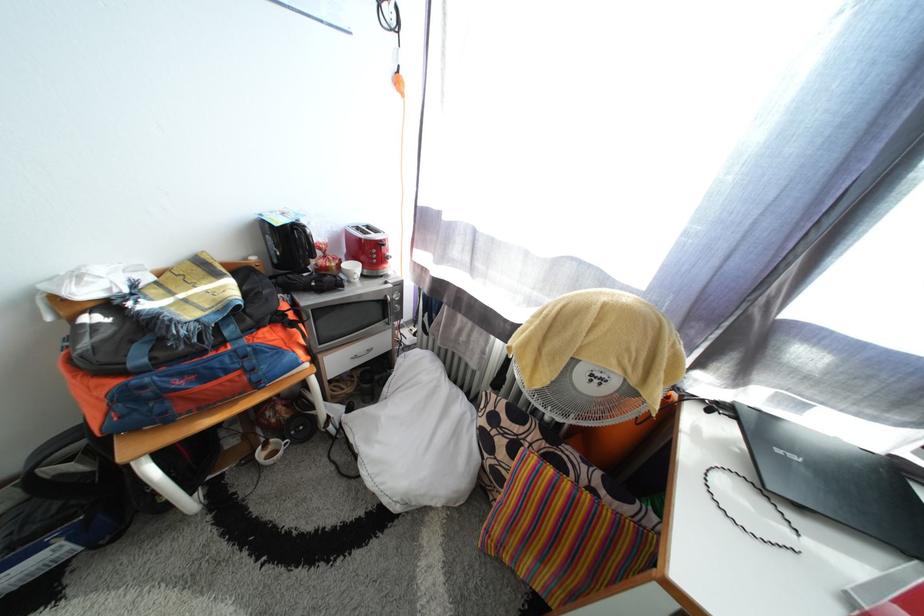
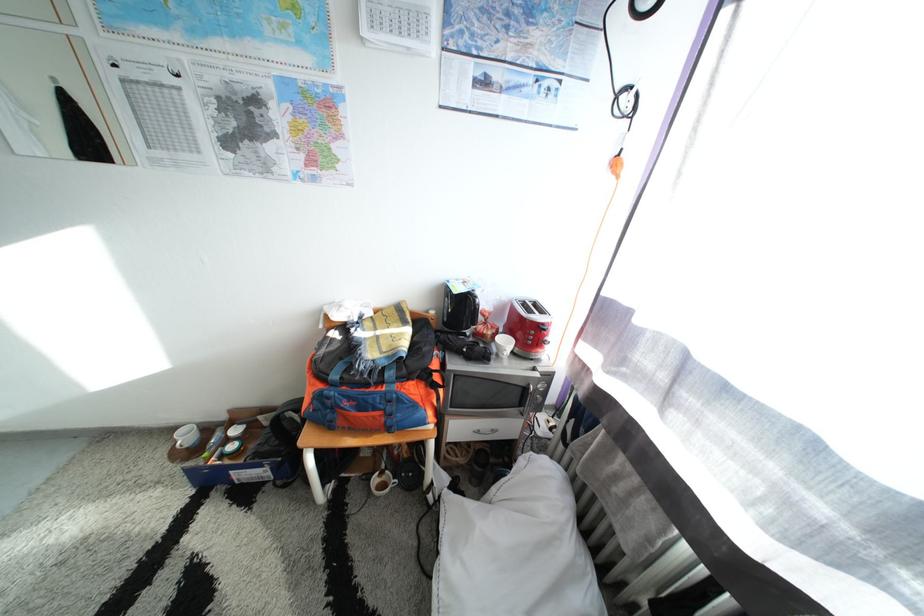
Question: The camera is either moving clockwise (left) or counter-clockwise (right) around the object. The first image is from the beginning of the video and the second image is from the end. Is the camera moving left or right when shooting the video?

Choices:
 (A) Left
 (B) Right

Answer: (B)